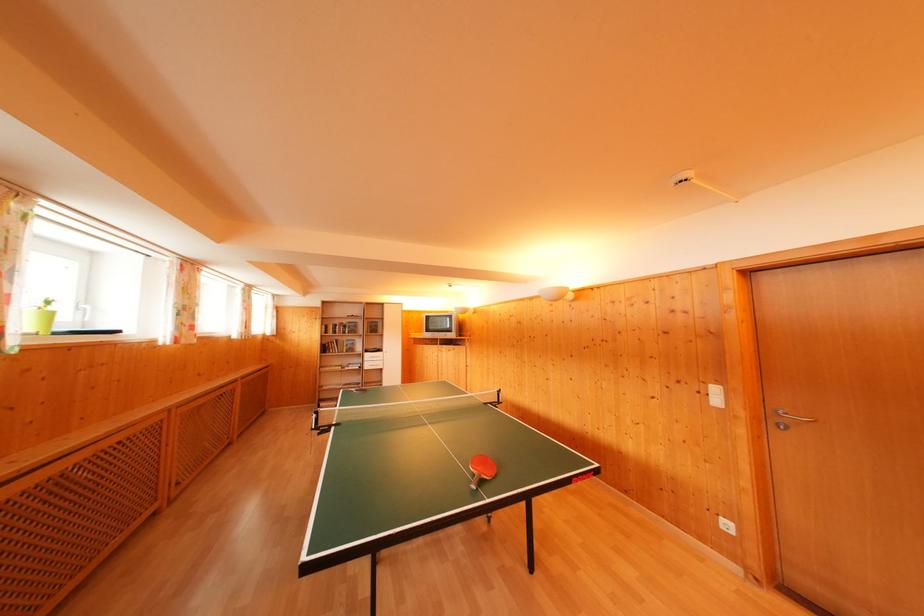
At what (x,y) coordinates should I click in order to perform the action: click on white light switch. Please return your answer as a coordinate pair (x, y). Image resolution: width=924 pixels, height=616 pixels. Looking at the image, I should click on (715, 395).